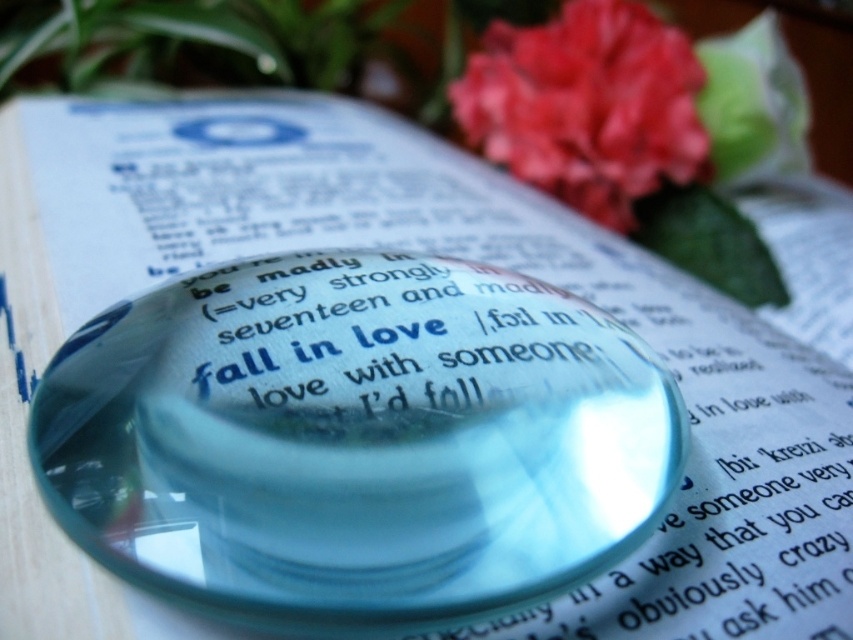
From the picture: Who is more forward, (140, 456) or (653, 106)?

Positioned in front is point (140, 456).

Which of these two, transparent glass magnifying glass at center or vivid red petals at upper right, stands shorter?

transparent glass magnifying glass at center is shorter.

Who is more distant from viewer, (x=349, y=614) or (x=492, y=152)?

Point (x=492, y=152)

Where is `transparent glass magnifying glass at center`? The image size is (853, 640). transparent glass magnifying glass at center is located at coordinates (355, 440).